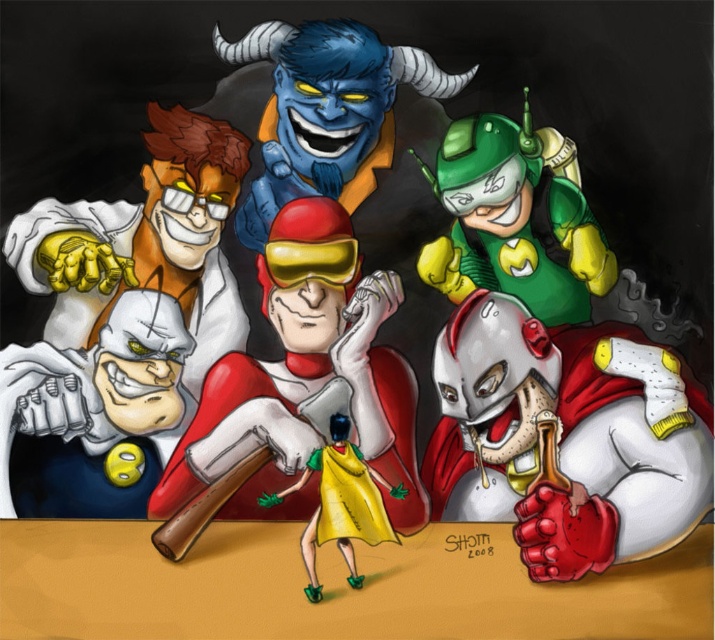
Can you confirm if shiny metallic helmet at lower right is taller than yellow matte cape at center?

Yes, shiny metallic helmet at lower right is taller than yellow matte cape at center.

Is shiny metallic helmet at lower right below yellow matte cape at center?

Actually, shiny metallic helmet at lower right is above yellow matte cape at center.

Who is more forward, [633,358] or [325,513]?

Positioned in front is point [325,513].

I want to click on shiny metallic helmet at lower right, so [x=566, y=436].

Does shiny metallic helmet at lower right have a lesser width compared to green matte robot at upper right?

No.

Which is in front, point (646, 456) or point (470, 285)?

Point (646, 456) is more forward.

You are a GUI agent. You are given a task and a screenshot of the screen. Output one action in this format:
    pyautogui.click(x=<x>, y=<y>)
    Task: Click on the shiny metallic helmet at lower right
    
    Given the screenshot: What is the action you would take?
    pyautogui.click(x=566, y=436)

Locate an element on the screen. This screenshot has width=715, height=640. shiny metallic helmet at lower right is located at coordinates (566, 436).

Is point (332, 412) positioned after point (418, 65)?

No, it is not.

Is smooth red cape at center thinner than blue rubber demon at upper center?

No, smooth red cape at center is not thinner than blue rubber demon at upper center.

Is point (315, 312) positioned before point (380, 74)?

That is False.

Image resolution: width=715 pixels, height=640 pixels. I want to click on smooth red cape at center, so click(x=305, y=394).